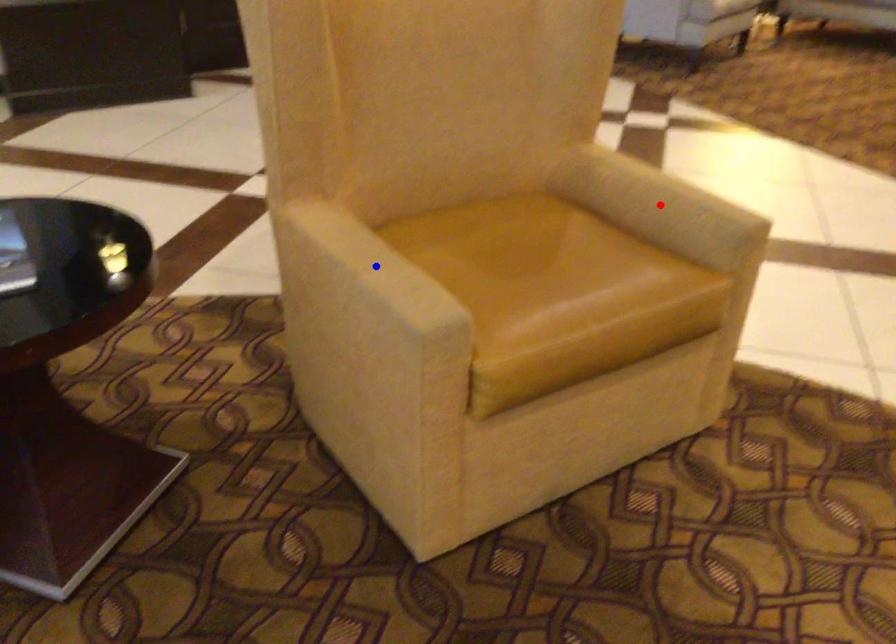
Question: In the image, two points are highlighted. Which point is nearer to the camera? Reply with the corresponding letter.

Choices:
 (A) blue point
 (B) red point

Answer: (A)